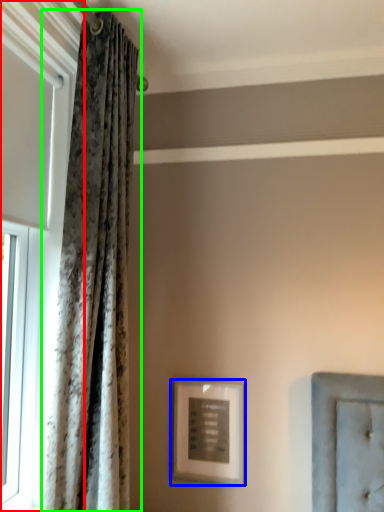
Question: Which object is positioned closest to window (highlighted by a red box)? Select from picture frame (highlighted by a blue box) and curtain (highlighted by a green box).

Choices:
 (A) picture frame
 (B) curtain

Answer: (B)